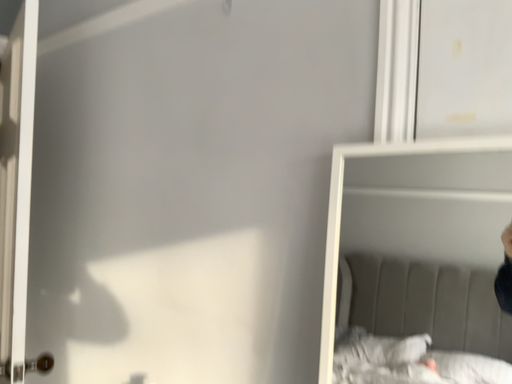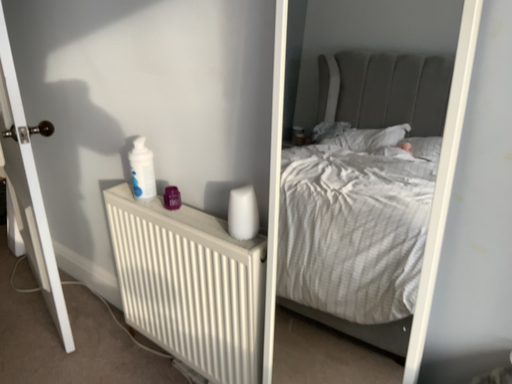
Question: Which way did the camera rotate in the video?

Choices:
 (A) rotated upward
 (B) rotated downward

Answer: (B)